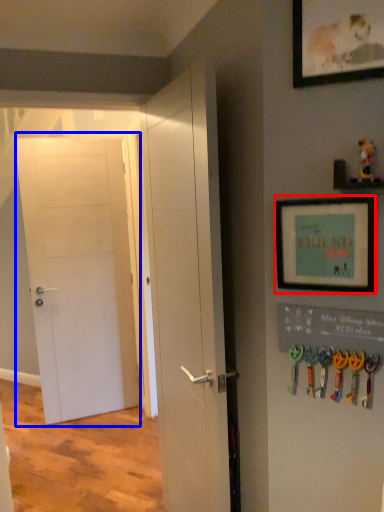
Question: Which point is further to the camera, picture frame (highlighted by a red box) or door (highlighted by a blue box)?

Choices:
 (A) picture frame
 (B) door

Answer: (B)